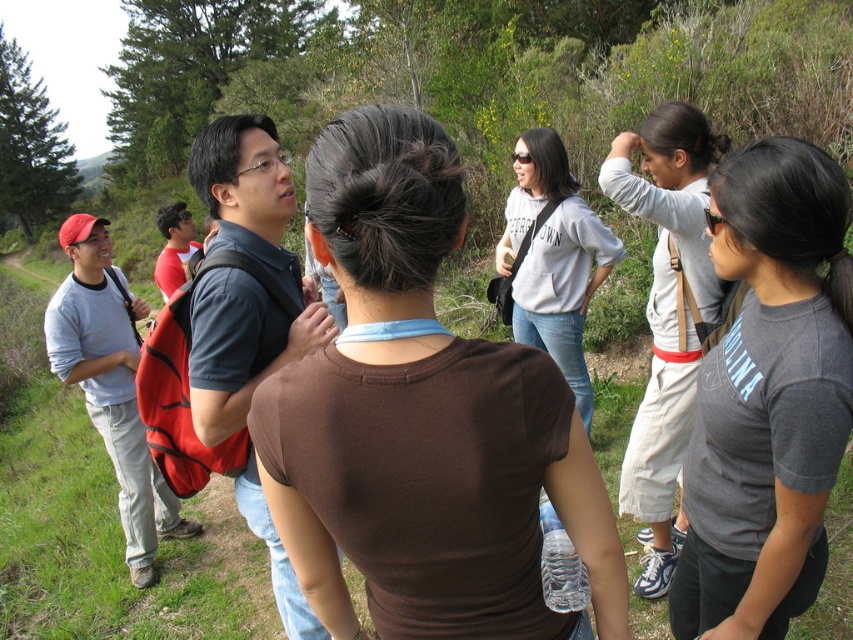
You are standing at the origin of a coordinate system placed at the bottom left corner of the image. A gray cotton tshirt is located at point (769, 396). If you want to move towards the gray cotton tshirt, in which direction should you move?

You should move northeast because the gray cotton tshirt at upper right is located at point (769, 396), which is northeast from the origin at bottom left.

You are a photographer trying to capture a group photo of the two people wearing the brown cotton shirt at center and the light gray cotton shirt at upper right. Which person should you focus on first to ensure they are in the foreground of the photo?

The brown cotton shirt at center should be focused on first because it is in front of the light gray cotton shirt at upper right, making it the foreground subject.

You are standing at point (664, 131) and want to walk to point (387, 609). Which direction should you move in relative to your current position?

You should move forward because point (387, 609) is in front of point (664, 131) from your current position.